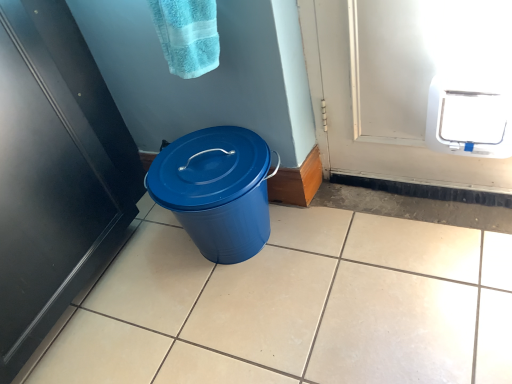
Question: Is black matte door at left bigger or smaller than white plastic pet door at upper right?

Choices:
 (A) small
 (B) big

Answer: (B)

Question: Is black matte door at left wider or thinner than white plastic pet door at upper right?

Choices:
 (A) thin
 (B) wide

Answer: (B)

Question: Based on their relative distances, which object is farther from the white plastic pet door at upper right?

Choices:
 (A) black matte door at left
 (B) turquoise terry cloth towel at upper center
 (C) blue plastic trash can at center

Answer: (A)

Question: Based on their relative distances, which object is farther from the blue plastic trash can at center?

Choices:
 (A) white plastic pet door at upper right
 (B) turquoise terry cloth towel at upper center
 (C) black matte door at left

Answer: (A)